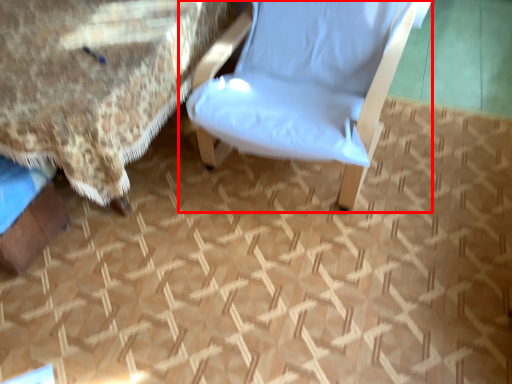
Question: From the image's perspective, what is the correct spatial positioning of chair (annotated by the red box) in reference to bed?

Choices:
 (A) above
 (B) below

Answer: (A)